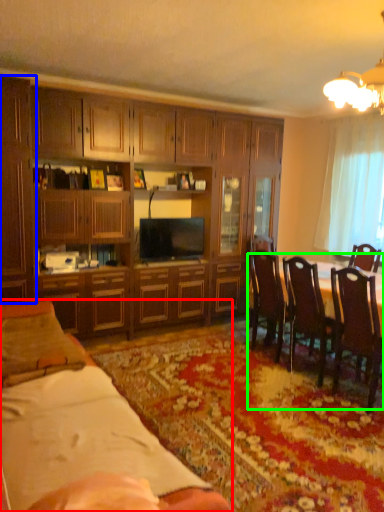
Question: Which is farther away from desk (highlighted by a red box)? cabinetry (highlighted by a blue box) or kitchen & dining room table (highlighted by a green box)?

Choices:
 (A) cabinetry
 (B) kitchen & dining room table

Answer: (B)